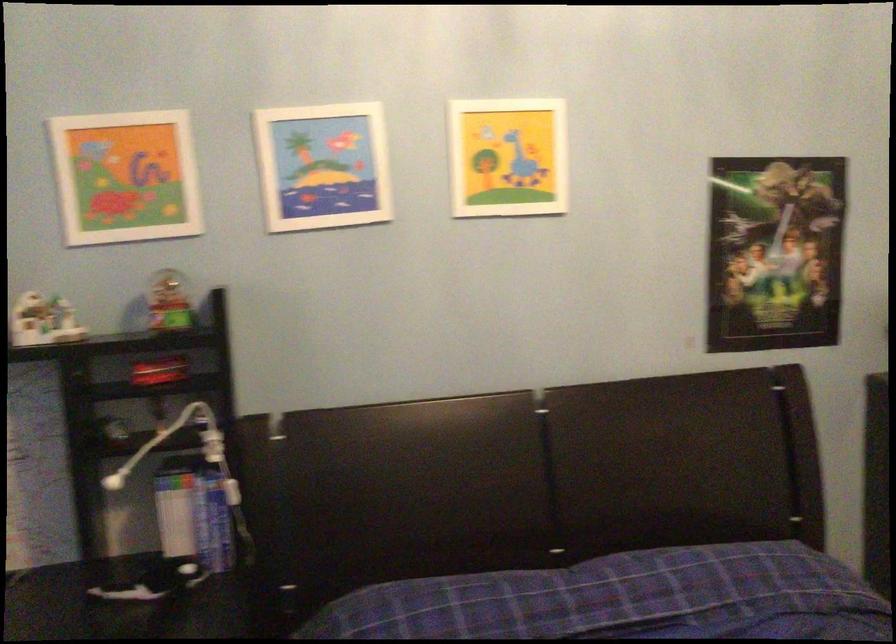
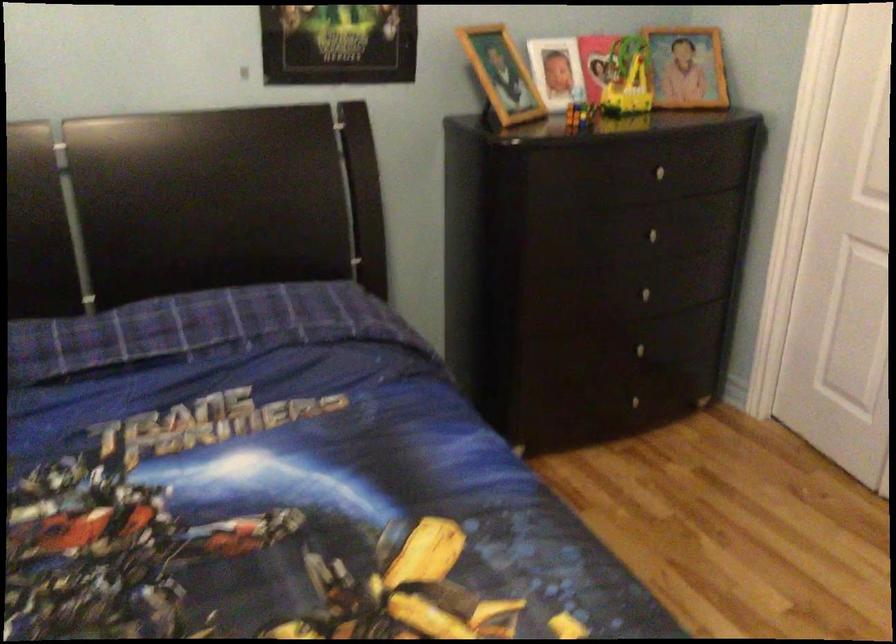
Question: Which direction would the cameraman need to move to produce the second image? Reply with the corresponding letter.

Choices:
 (A) Left
 (B) Right
 (C) Forward
 (D) Backward

Answer: (B)